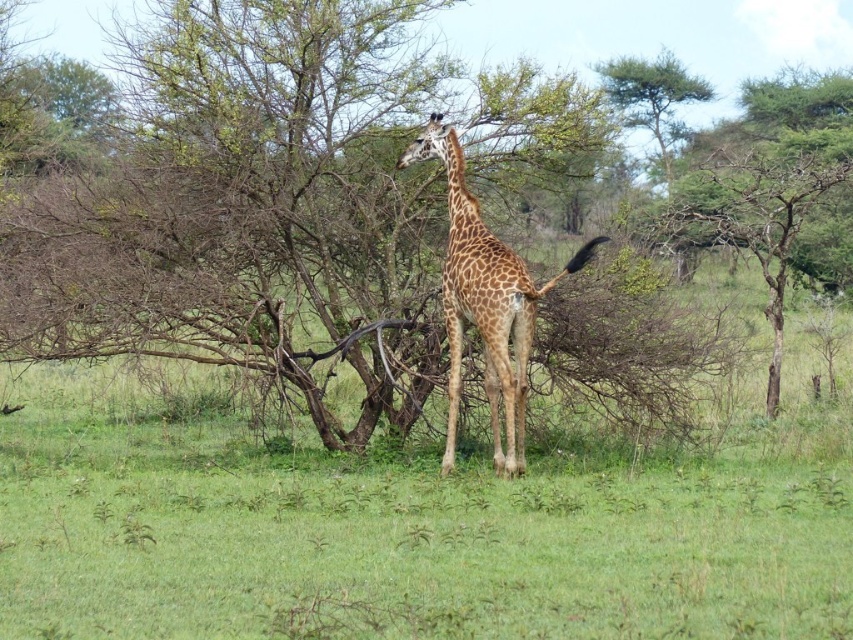
You are a photographer trying to capture the spotted fur giraffe at center and the brown leafless tree at center in the same frame. Based on their positions, which object is positioned to the left of the other?

The brown leafless tree at center is positioned to the left of the spotted fur giraffe at center.

You are standing in the savanna and see two points marked in the image. Which point, point (451, 298) or point (596, 72), is closer to you?

Point (451, 298) is closer to the viewer than point (596, 72).

From the picture: You are a wildlife photographer planning to capture the giraffe and the tree in the same frame. Given that the camera can only focus on objects wider than 2 meters, can both the spotted fur giraffe at center and the green leafy tree at upper center fit within the camera focus range?

The spotted fur giraffe at center is narrower than the green leafy tree at upper center. Since the camera requires objects wider than 2 meters, we need to know their exact widths. However, the description only states their relative sizes. Without specific measurements, it is impossible to confirm if both meet the 2 meter requirement.